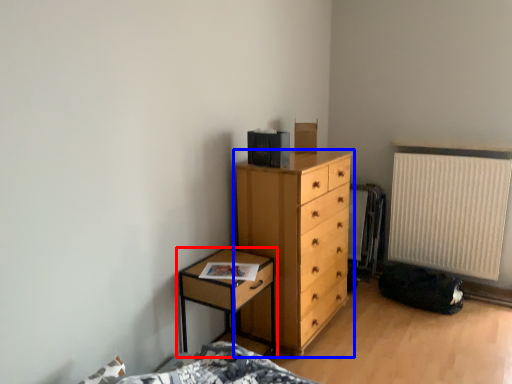
Question: Which object is further to the camera taking this photo, nightstand (highlighted by a red box) or chest of drawers (highlighted by a blue box)?

Choices:
 (A) nightstand
 (B) chest of drawers

Answer: (B)